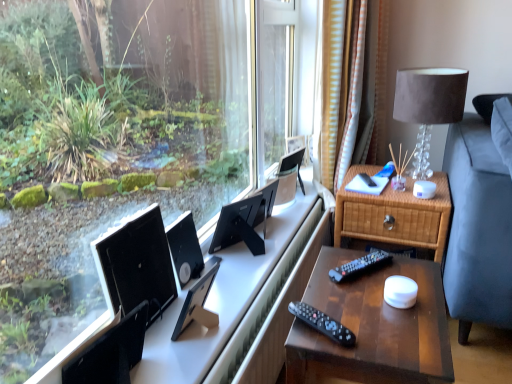
You are a GUI agent. You are given a task and a screenshot of the screen. Output one action in this format:
    pyautogui.click(x=<x>, y=<y>)
    Task: Click on the spots to the right of black plastic remote control at lower center, acting as the 2th remote control starting from the front
    The image size is (512, 384).
    Given the screenshot: What is the action you would take?
    [409, 276]